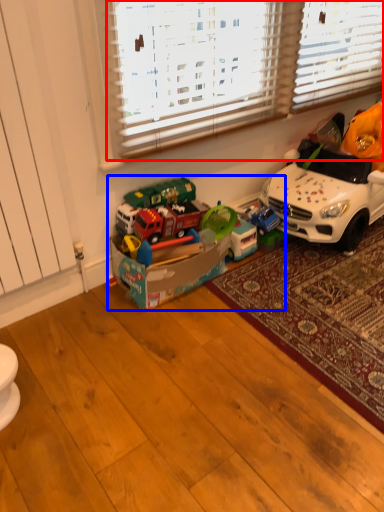
Question: Among these objects, which one is farthest to the camera, blind (highlighted by a red box) or toy (highlighted by a blue box)?

Choices:
 (A) blind
 (B) toy

Answer: (B)